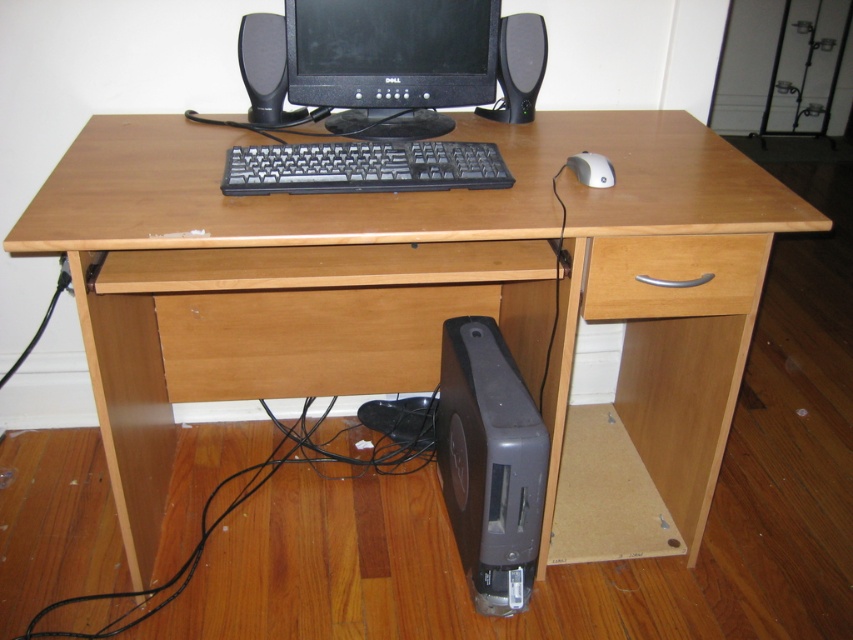
Question: Is black matte monitor at center to the right of black plastic computer at lower center from the viewer's perspective?

Choices:
 (A) no
 (B) yes

Answer: (A)

Question: Observing the image, what is the correct spatial positioning of black plastic computer at lower center in reference to black plastic speaker at upper center?

Choices:
 (A) right
 (B) left

Answer: (A)

Question: Is black plastic speaker at upper center positioned before black plastic speaker at upper right?

Choices:
 (A) no
 (B) yes

Answer: (B)

Question: Which point is closer to the camera?

Choices:
 (A) (281, 17)
 (B) (454, 13)
 (C) (509, 74)
 (D) (590, 184)

Answer: (D)

Question: Which point is closer to the camera?

Choices:
 (A) (599, 157)
 (B) (427, 156)

Answer: (A)

Question: Among these objects, which one is farthest from the camera?

Choices:
 (A) black matte monitor at center
 (B) beech wood drawer at right
 (C) black plastic speaker at upper center
 (D) black plastic speaker at upper right

Answer: (D)